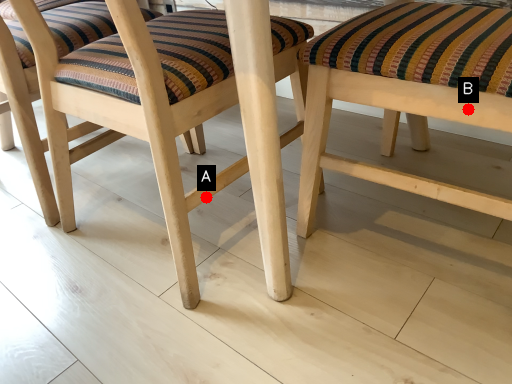
Question: Two points are circled on the image, labeled by A and B beside each circle. Which point is farther from the camera taking this photo?

Choices:
 (A) A is further
 (B) B is further

Answer: (A)